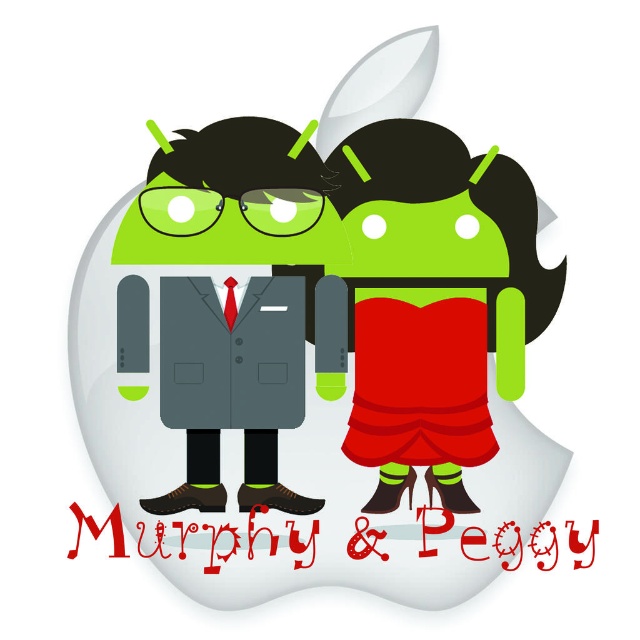
What is the exact coordinate of the matte black suit at center?

The matte black suit at center is located at point (316, 353).

You are an interior designer planning a modern living room. You have two suits displayed in the center of the room. The matte black suit at center and the matte gray suit at center. According to the scene, which suit is placed higher?

The matte black suit at center is located above the matte gray suit at center, so the matte black suit at center is placed higher.